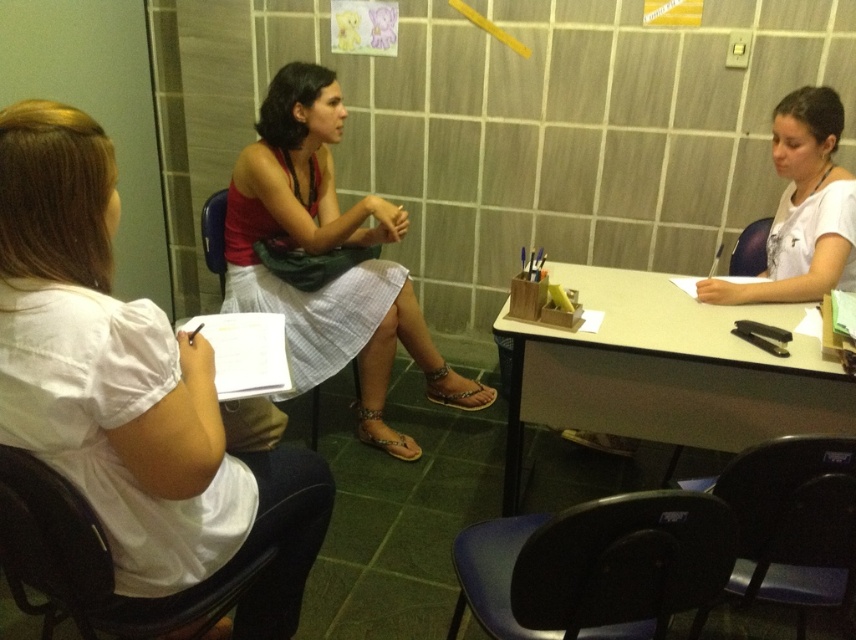
Which is behind, point (827, 536) or point (203, 243)?

The point (203, 243) is more distant.

Can you confirm if black plastic chair at lower right is positioned to the left of blue plastic chair at center?

Incorrect, black plastic chair at lower right is not on the left side of blue plastic chair at center.

Image resolution: width=856 pixels, height=640 pixels. What do you see at coordinates (794, 522) in the screenshot? I see `black plastic chair at lower right` at bounding box center [794, 522].

Where is `black plastic chair at lower right`? Image resolution: width=856 pixels, height=640 pixels. black plastic chair at lower right is located at coordinates pyautogui.click(x=794, y=522).

In the scene shown: Which is more to the left, white cotton shirt at left or black plastic chair at lower right?

white cotton shirt at left is more to the left.

Describe the element at coordinates (132, 390) in the screenshot. I see `white cotton shirt at left` at that location.

Measure the distance between point (194, 400) and camera.

3.98 feet

At what (x,y) coordinates should I click in order to perform the action: click on white cotton shirt at left. Please return your answer as a coordinate pair (x, y). Looking at the image, I should click on (132, 390).

Does white glossy table at center have a greater width compared to matte red tank top at center?

No.

Can you confirm if white glossy table at center is shorter than matte red tank top at center?

Yes, white glossy table at center is shorter than matte red tank top at center.

Identify the location of white glossy table at center. This screenshot has height=640, width=856. (664, 371).

Where is `white glossy table at center`? The height and width of the screenshot is (640, 856). white glossy table at center is located at coordinates (664, 371).